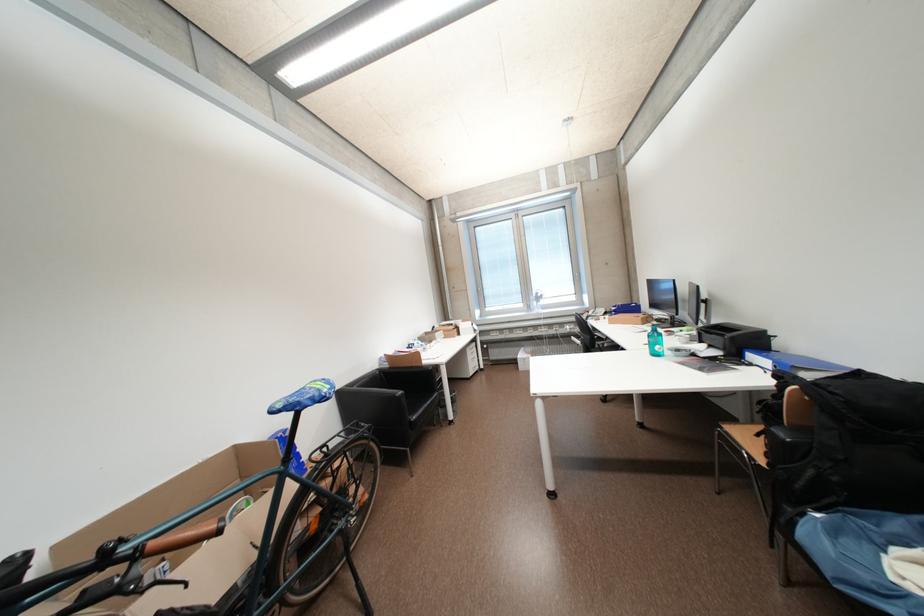
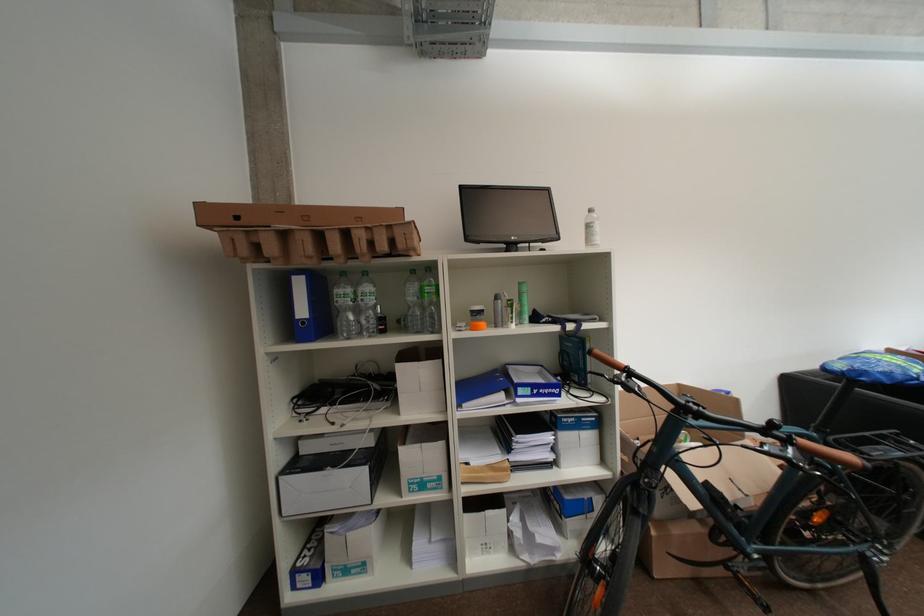
Question: How did the camera likely rotate?

Choices:
 (A) Left
 (B) Right
 (C) Up
 (D) Down

Answer: (A)